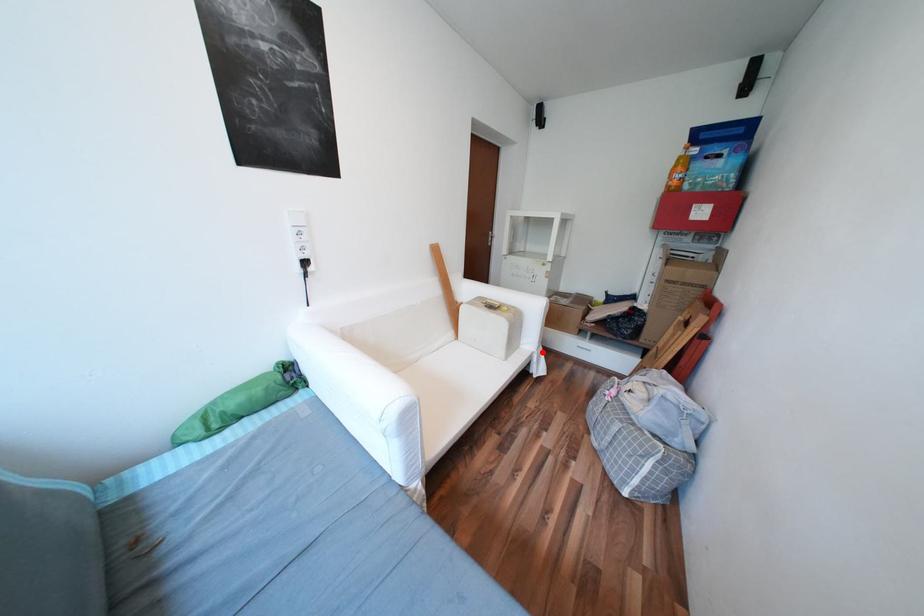
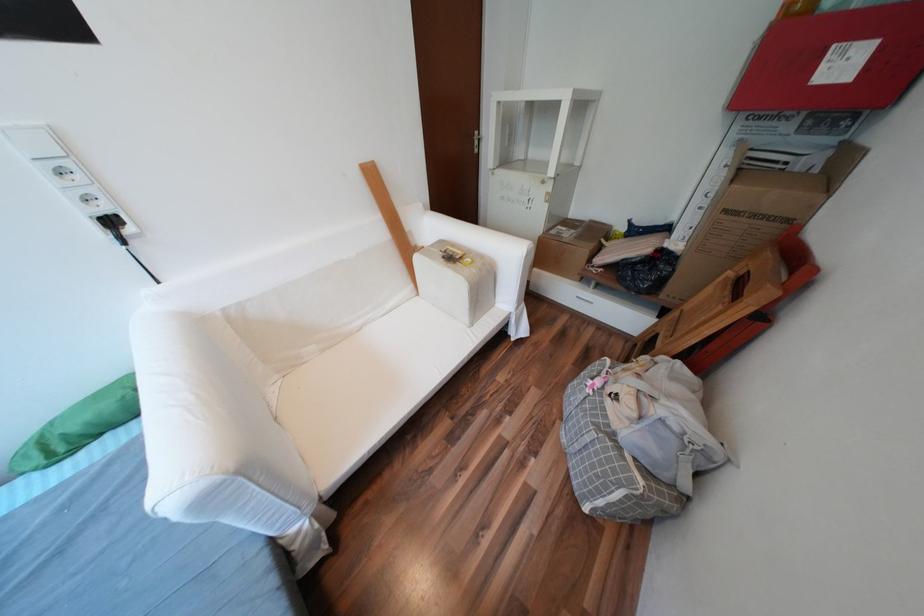
In the second image, find the point that corresponds to the highlighted location in the first image.

(519, 313)